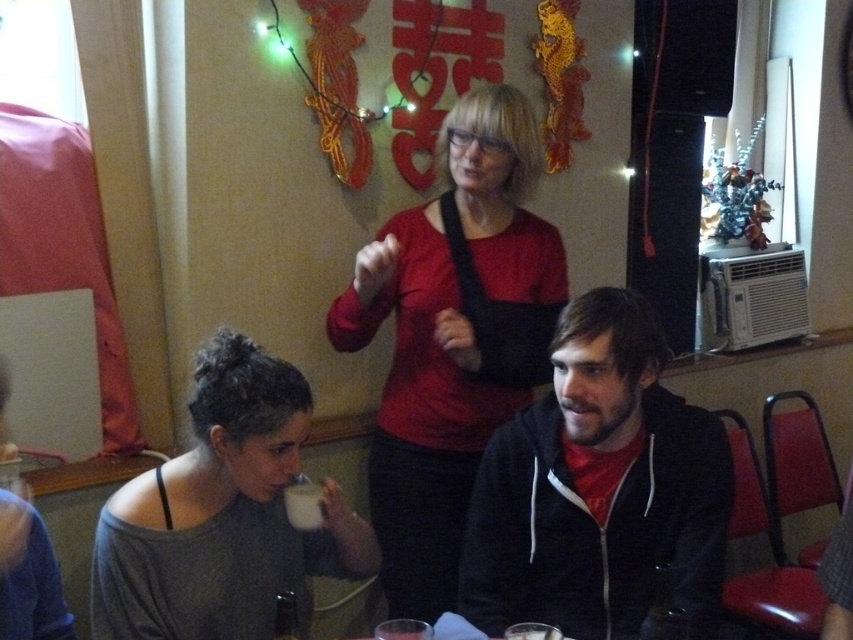
Is dark gray hoodie at center wider than white glossy mug at lower center?

Yes.

Identify the location of dark gray hoodie at center. (599, 488).

Does matte red shirt at center have a larger size compared to white matte cup at lower center?

Indeed, matte red shirt at center has a larger size compared to white matte cup at lower center.

What are the coordinates of `matte red shirt at center` in the screenshot? It's located at (451, 337).

Who is lower down, matte red shirt at center or gray matte shirt at lower left?

Positioned lower is gray matte shirt at lower left.

Which is behind, point (532, 234) or point (212, 625)?

Point (532, 234)

Where is `matte red shirt at center`? Image resolution: width=853 pixels, height=640 pixels. matte red shirt at center is located at coordinates (451, 337).